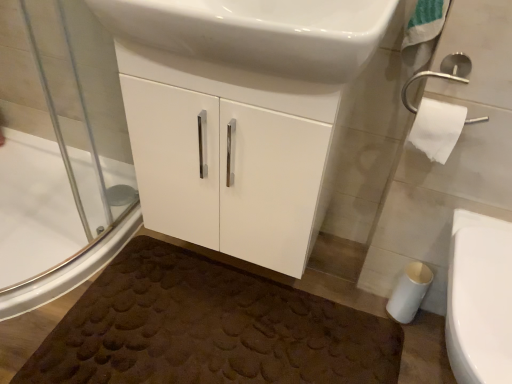
Locate an element on the screen. vacant point to the right of white matte toilet paper at lower right, which is counted as the first toilet paper, starting from the back is located at coordinates (429, 319).